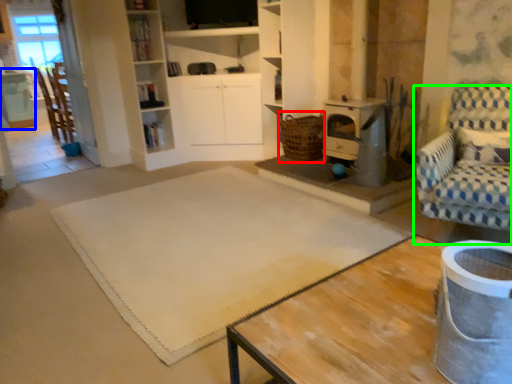
Question: Which object is positioned closest to basket (highlighted by a red box)? Select from table (highlighted by a blue box) and chair (highlighted by a green box).

Choices:
 (A) table
 (B) chair

Answer: (B)